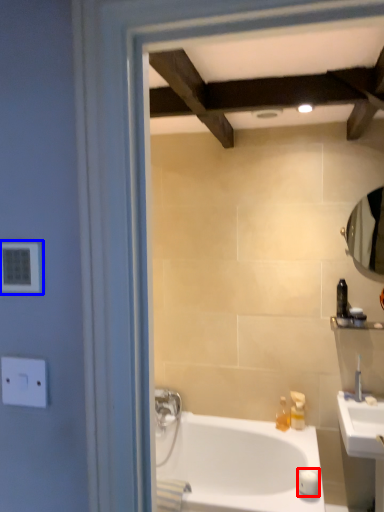
Question: Which of the following is the farthest to the observer, soap (highlighted by a red box) or electric outlet (highlighted by a blue box)?

Choices:
 (A) soap
 (B) electric outlet

Answer: (A)